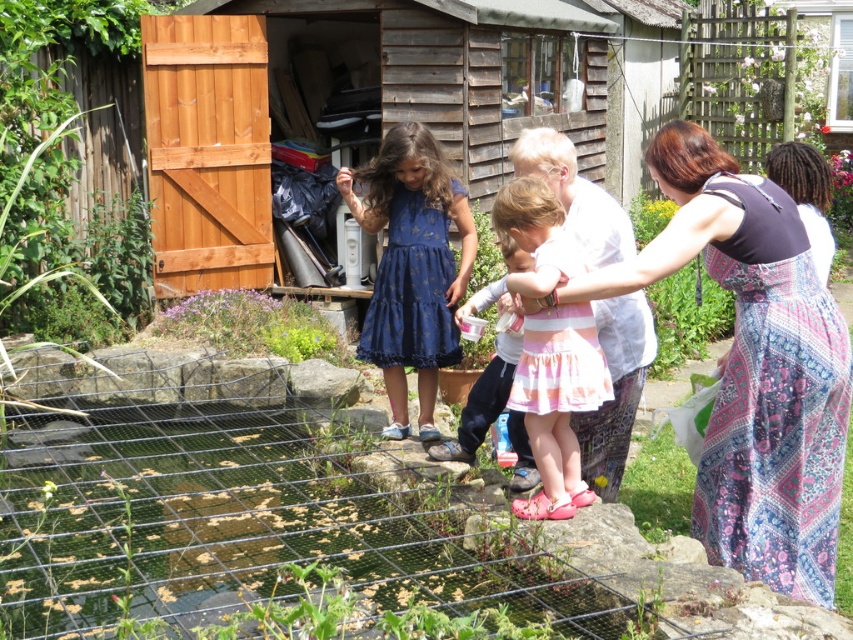
You are a photographer trying to capture a candid shot of both the printed cotton dress at center and the blue satin dress at center. Since you want to ensure both are in the frame, which dress should you position your camera closer to to include both?

To include both the printed cotton dress at center and the blue satin dress at center in the frame, position your camera closer to the blue satin dress at center since the printed cotton dress at center is already to the right of it, allowing you to adjust the angle to capture both without excluding either.

You are standing at the edge of the metal grid structure in the garden. You want to walk directly towards the wooden shed at upper center. Which direction should you walk in?

The wooden shed at upper center is located at point (369, 100). Since you are at the edge of the metal grid structure in the foreground, you should walk towards the upper center direction to reach the wooden shed at upper center.